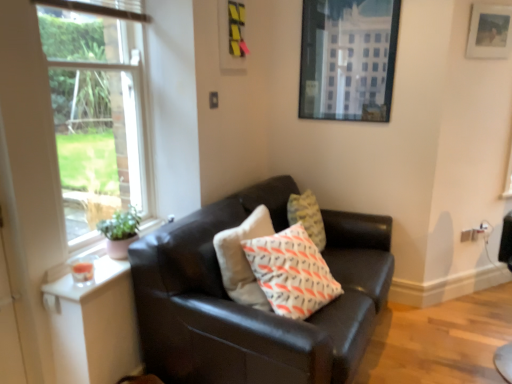
Question: Is white cotton pillow at center to the left of matte black couch at center from the viewer's perspective?

Choices:
 (A) yes
 (B) no

Answer: (B)

Question: Considering the relative sizes of white cotton pillow at center and matte black couch at center in the image provided, is white cotton pillow at center shorter than matte black couch at center?

Choices:
 (A) no
 (B) yes

Answer: (B)

Question: Is white cotton pillow at center outside of matte black couch at center?

Choices:
 (A) yes
 (B) no

Answer: (B)

Question: Is white cotton pillow at center oriented away from matte black couch at center?

Choices:
 (A) no
 (B) yes

Answer: (B)

Question: Considering the relative positions of white cotton pillow at center and matte black couch at center in the image provided, is white cotton pillow at center to the right of matte black couch at center from the viewer's perspective?

Choices:
 (A) no
 (B) yes

Answer: (B)

Question: From their relative heights in the image, would you say clear glass window at upper left is taller or shorter than wooden picture frame at upper right, marked as the second picture frame in a left-to-right arrangement?

Choices:
 (A) tall
 (B) short

Answer: (A)

Question: Is point (113, 183) positioned closer to the camera than point (468, 38)?

Choices:
 (A) farther
 (B) closer

Answer: (A)

Question: Relative to wooden picture frame at upper right, which appears as the 1th picture frame when viewed from the right, is clear glass window at upper left in front or behind?

Choices:
 (A) front
 (B) behind

Answer: (A)

Question: Looking at the image, does clear glass window at upper left seem bigger or smaller compared to wooden picture frame at upper right, marked as the second picture frame in a left-to-right arrangement?

Choices:
 (A) small
 (B) big

Answer: (B)

Question: Choose the correct answer: Is wooden picture frame at upper right, which appears as the 1th picture frame when viewed from the right, inside white cotton pillow at center or outside it?

Choices:
 (A) outside
 (B) inside

Answer: (A)

Question: Looking at their shapes, would you say wooden picture frame at upper right, which appears as the 1th picture frame when viewed from the right, is wider or thinner than white cotton pillow at center?

Choices:
 (A) thin
 (B) wide

Answer: (A)

Question: From the image's perspective, is wooden picture frame at upper right, marked as the second picture frame in a left-to-right arrangement, above or below white cotton pillow at center?

Choices:
 (A) above
 (B) below

Answer: (A)

Question: Is wooden picture frame at upper right, which appears as the 1th picture frame when viewed from the right, taller or shorter than white cotton pillow at center?

Choices:
 (A) tall
 (B) short

Answer: (B)

Question: In the image, is white cotton pillow at center positioned in front of or behind clear glass window at upper left?

Choices:
 (A) front
 (B) behind

Answer: (B)

Question: Considering the positions of white cotton pillow at center and clear glass window at upper left in the image, is white cotton pillow at center taller or shorter than clear glass window at upper left?

Choices:
 (A) short
 (B) tall

Answer: (A)